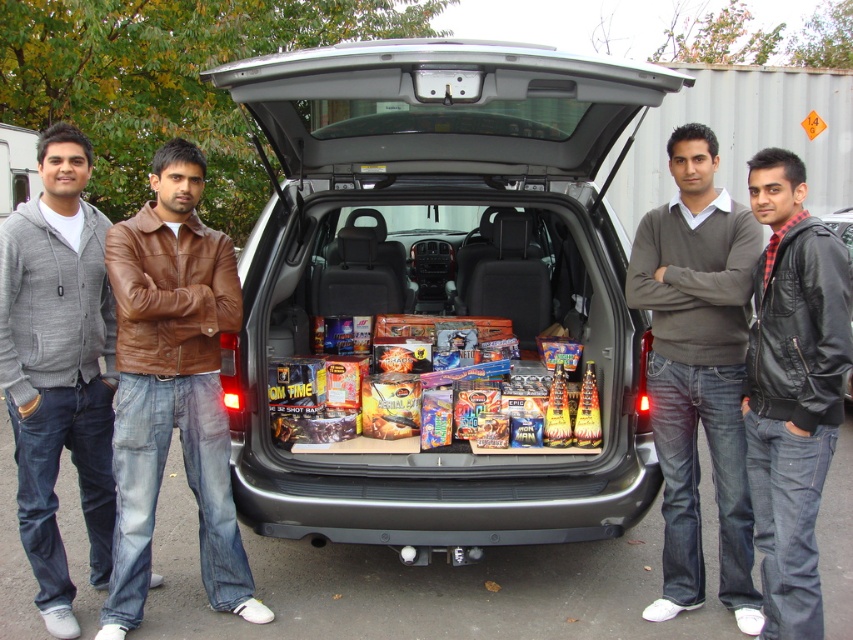
What is the exact coordinate of the multicolored cardboard fireworks at center?

The multicolored cardboard fireworks at center is located at coordinate point (460, 416).

You are a delivery person who needs to place a large box in the trunk of the SUV. The box is 30 inches long. Based on the distance between the black leather jacket at center and the black leather jacket at lower right, can you fit the box horizontally in the trunk?

The distance between the black leather jacket at center and the black leather jacket at lower right is 29.17 inches. Since the box is 30 inches long, it is slightly longer than the available space, so it won

You are a customer looking to buy fireworks from the trunk of the SUV. You see the multicolored cardboard fireworks at center and the black leather jacket at lower right. Which item is closer to you?

The multicolored cardboard fireworks at center is positioned under the black leather jacket at lower right, so the black leather jacket at lower right is closer to you.